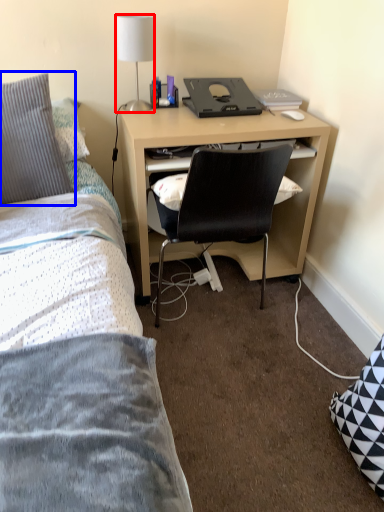
Question: Among these objects, which one is farthest to the camera, lamp (highlighted by a red box) or pillow (highlighted by a blue box)?

Choices:
 (A) lamp
 (B) pillow

Answer: (A)